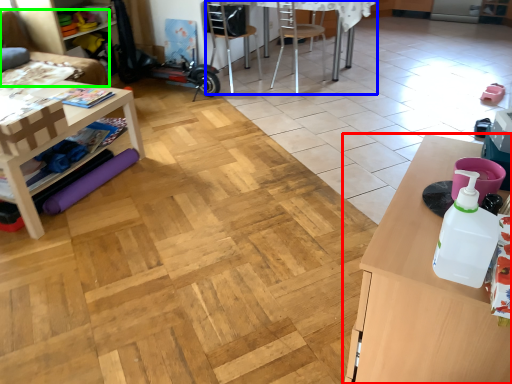
Question: Considering the real-world distances, which object is closest to table (highlighted by a red box)? computer desk (highlighted by a blue box) or couch (highlighted by a green box).

Choices:
 (A) computer desk
 (B) couch

Answer: (A)